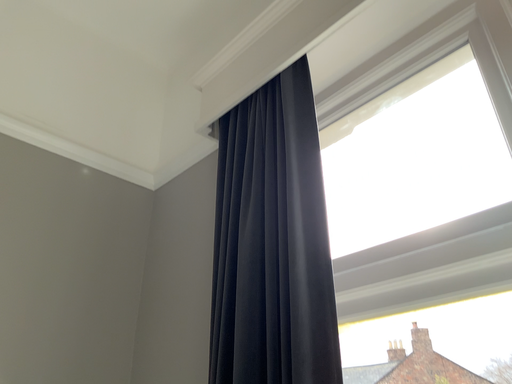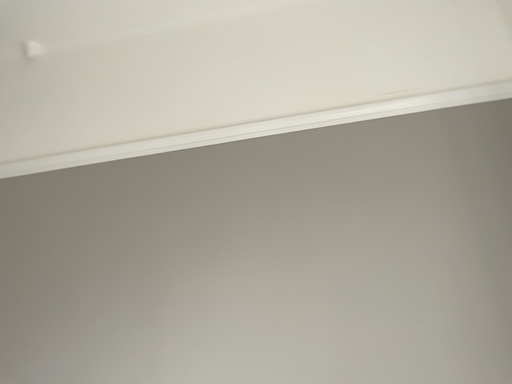
Question: Which way did the camera rotate in the video?

Choices:
 (A) rotated right
 (B) rotated left

Answer: (B)